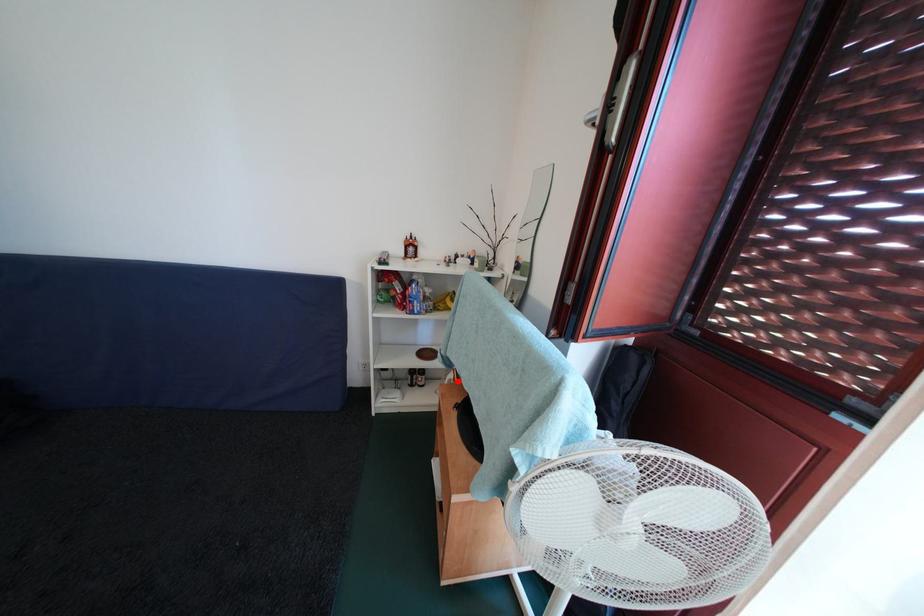
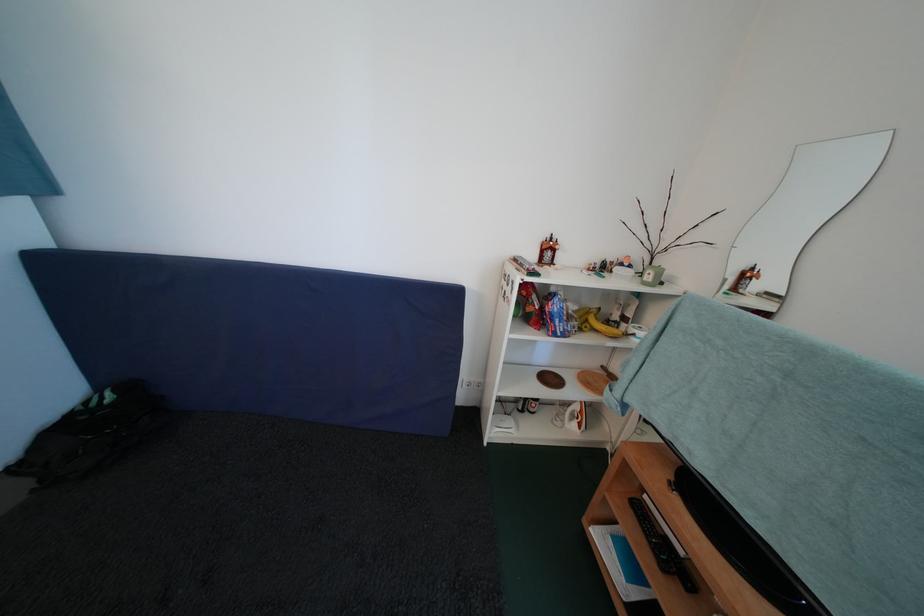
Find the pixel in the second image that matches the highlighted location in the first image.

(584, 411)